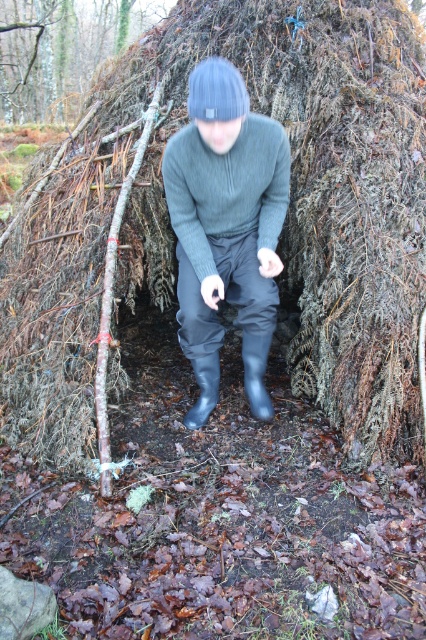
Question: Which of the following is the farthest from the observer?

Choices:
 (A) (244, 380)
 (B) (241, 209)
 (C) (85, 72)

Answer: (C)

Question: Which object appears farthest from the camera in this image?

Choices:
 (A) blue rubber boot at center
 (B) matte gray sweater at center
 (C) rubber boot at lower center

Answer: (C)

Question: Which point is farther to the camera?

Choices:
 (A) brown rough bark at upper left
 (B) rubber boot at lower center
 (C) matte gray sweater at center
 (D) blue rubber boot at center

Answer: (A)

Question: Does brown rough bark at upper left have a greater width compared to blue rubber boot at center?

Choices:
 (A) no
 (B) yes

Answer: (B)

Question: Does brown rough bark at upper left appear under blue rubber boot at center?

Choices:
 (A) no
 (B) yes

Answer: (A)

Question: Is matte gray sweater at center further to the viewer compared to brown rough bark at upper left?

Choices:
 (A) no
 (B) yes

Answer: (A)